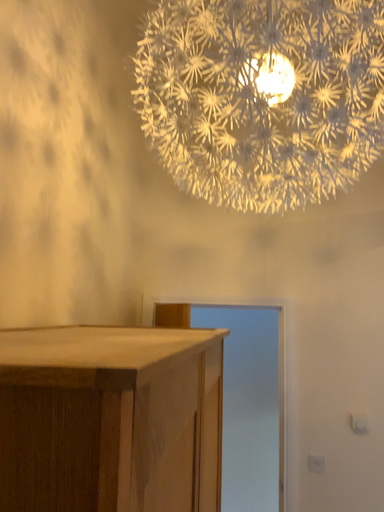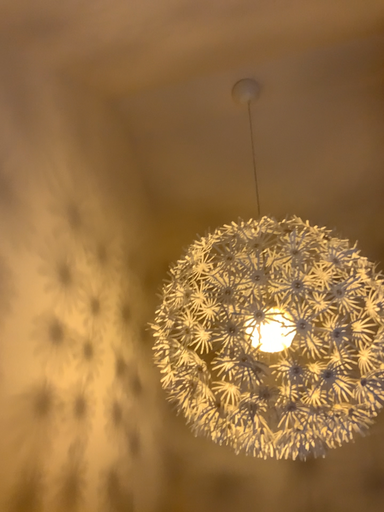
Question: How did the camera likely rotate when shooting the video?

Choices:
 (A) rotated left
 (B) rotated right

Answer: (A)